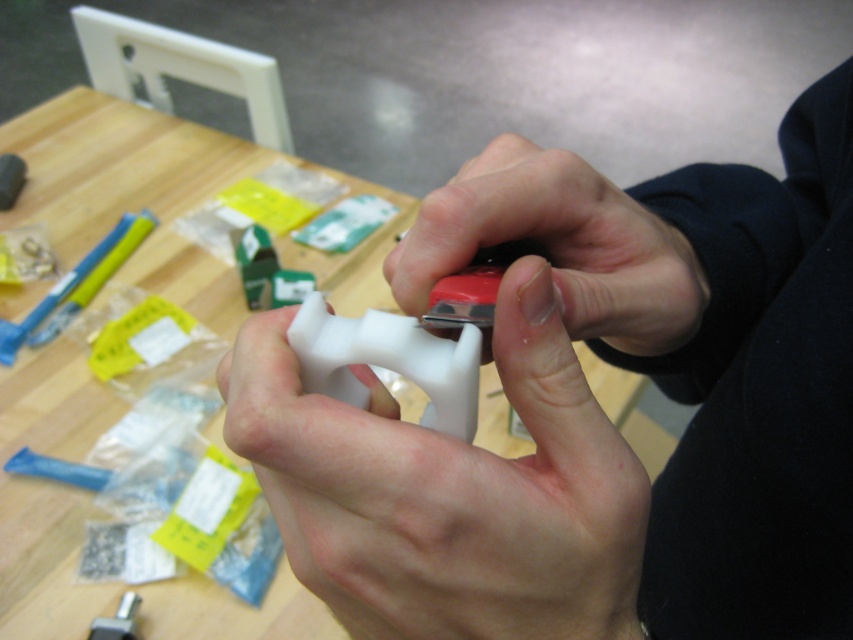
Can you confirm if white matte plastic object at center is shorter than wooden table at center?

Correct, white matte plastic object at center is not as tall as wooden table at center.

Is white matte plastic object at center in front of wooden table at center?

Yes, white matte plastic object at center is in front of wooden table at center.

Where is `white matte plastic object at center`? This screenshot has height=640, width=853. white matte plastic object at center is located at coordinates [x=596, y=408].

Find the location of a particular element. This screenshot has width=853, height=640. white matte plastic object at center is located at coordinates (596, 408).

Can you confirm if wooden table at center is bigger than white matte game controller at center?

Yes.

From the picture: Does wooden table at center have a smaller size compared to white matte game controller at center?

Incorrect, wooden table at center is not smaller in size than white matte game controller at center.

Is point (15, 380) closer to viewer compared to point (328, 339)?

No, (15, 380) is further to viewer.

Locate an element on the screen. This screenshot has height=640, width=853. wooden table at center is located at coordinates (131, 189).

Is point (840, 291) less distant than point (440, 564)?

No, (840, 291) is further to viewer.

Between white matte plastic object at center and white matte plastic at center, which one is positioned higher?

white matte plastic at center

Consider the image. Who is more distant from viewer, (645, 547) or (323, 492)?

Positioned behind is point (645, 547).

The image size is (853, 640). I want to click on white matte plastic object at center, so click(596, 408).